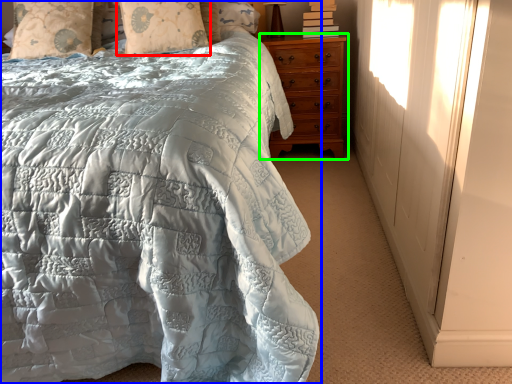
Question: Estimate the real-world distances between objects in this image. Which object is closer to pillow (highlighted by a red box), bed (highlighted by a blue box) or chest of drawers (highlighted by a green box)?

Choices:
 (A) bed
 (B) chest of drawers

Answer: (B)